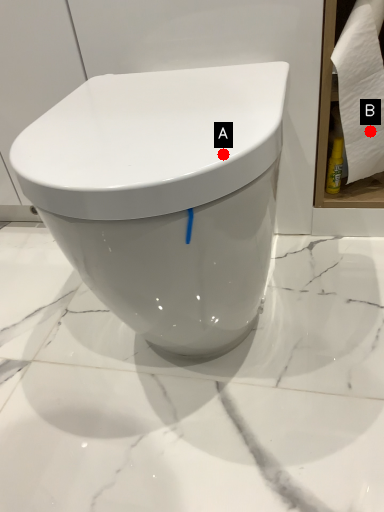
Question: Two points are circled on the image, labeled by A and B beside each circle. Which point is further to the camera?

Choices:
 (A) A is further
 (B) B is further

Answer: (B)